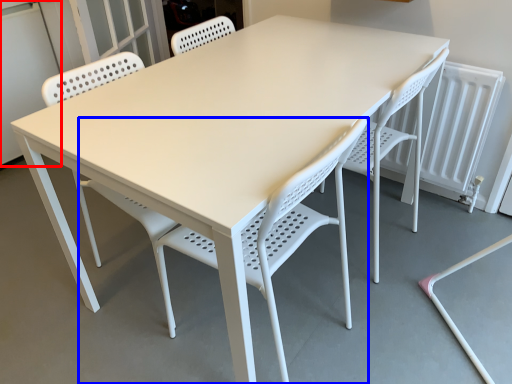
Question: Which point is further to the camera, screen door (highlighted by a red box) or chair (highlighted by a blue box)?

Choices:
 (A) screen door
 (B) chair

Answer: (A)